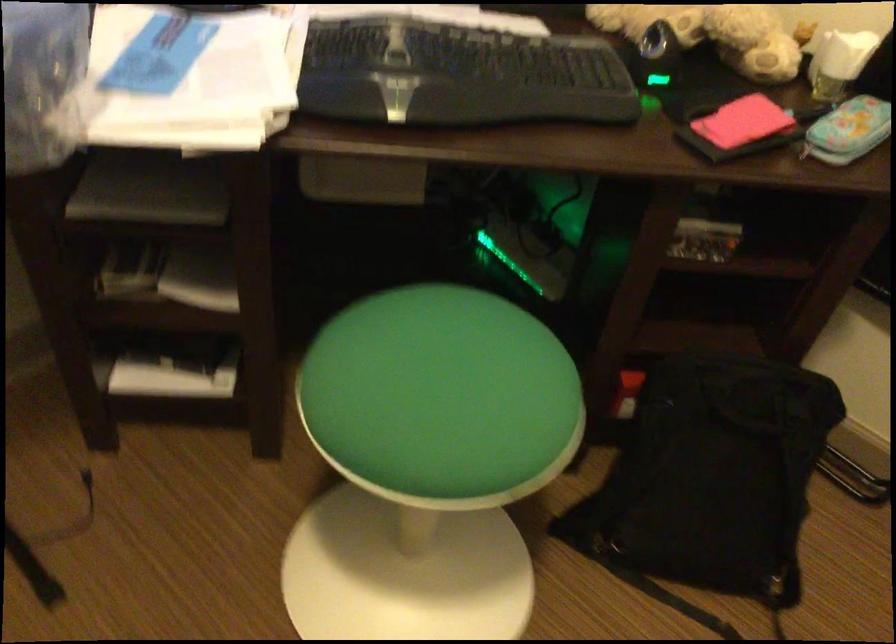
The image size is (896, 644). What do you see at coordinates (659, 43) in the screenshot?
I see `a black computer mouse` at bounding box center [659, 43].